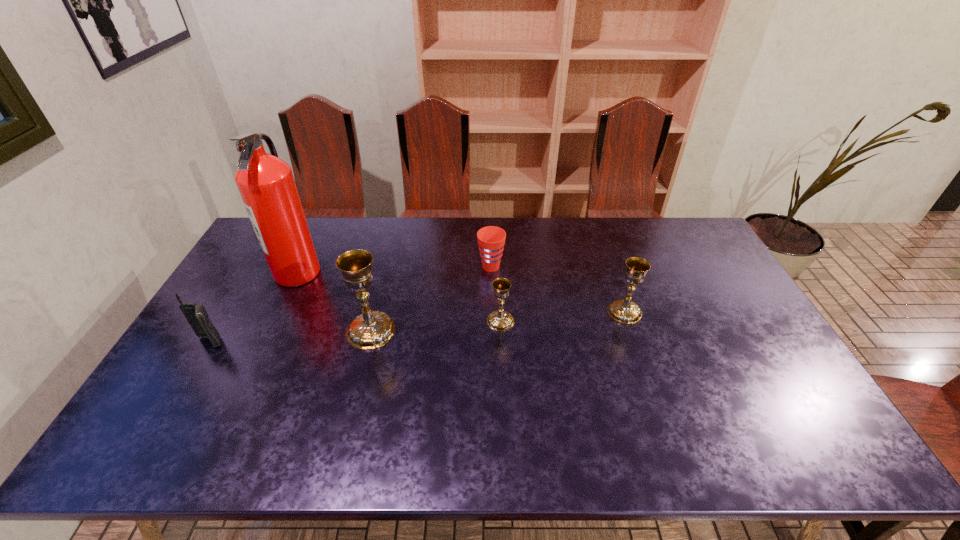
Find the location of a particular element. The height and width of the screenshot is (540, 960). free space that satisfies the following two spatial constraints: 1. at the nozzle of the tallest object; 2. on the left side of the second tallest object is located at coordinates (270, 330).

Image resolution: width=960 pixels, height=540 pixels. Identify the location of free space that satisfies the following two spatial constraints: 1. at the nozzle of the leftmost chalice; 2. on the right side of the second object from left to right. (270, 330).